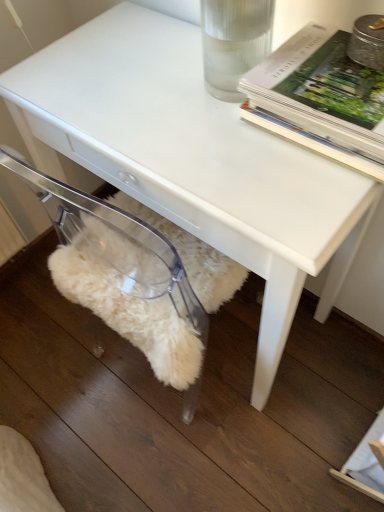
Question: Is transparent acrylic swivel chair at lower left bigger or smaller than hardcover book at upper right?

Choices:
 (A) big
 (B) small

Answer: (A)

Question: From the image's perspective, relative to hardcover book at upper right, is transparent acrylic swivel chair at lower left above or below?

Choices:
 (A) below
 (B) above

Answer: (A)

Question: Is transparent acrylic swivel chair at lower left inside the boundaries of hardcover book at upper right, or outside?

Choices:
 (A) inside
 (B) outside

Answer: (B)

Question: Does point (322, 36) appear closer or farther from the camera than point (87, 260)?

Choices:
 (A) farther
 (B) closer

Answer: (B)

Question: From a real-world perspective, is hardcover book at upper right positioned above or below transparent acrylic swivel chair at lower left?

Choices:
 (A) below
 (B) above

Answer: (B)

Question: Considering the positions of hardcover book at upper right and transparent acrylic swivel chair at lower left in the image, is hardcover book at upper right bigger or smaller than transparent acrylic swivel chair at lower left?

Choices:
 (A) big
 (B) small

Answer: (B)

Question: Do you think hardcover book at upper right is within transparent acrylic swivel chair at lower left, or outside of it?

Choices:
 (A) inside
 (B) outside

Answer: (B)